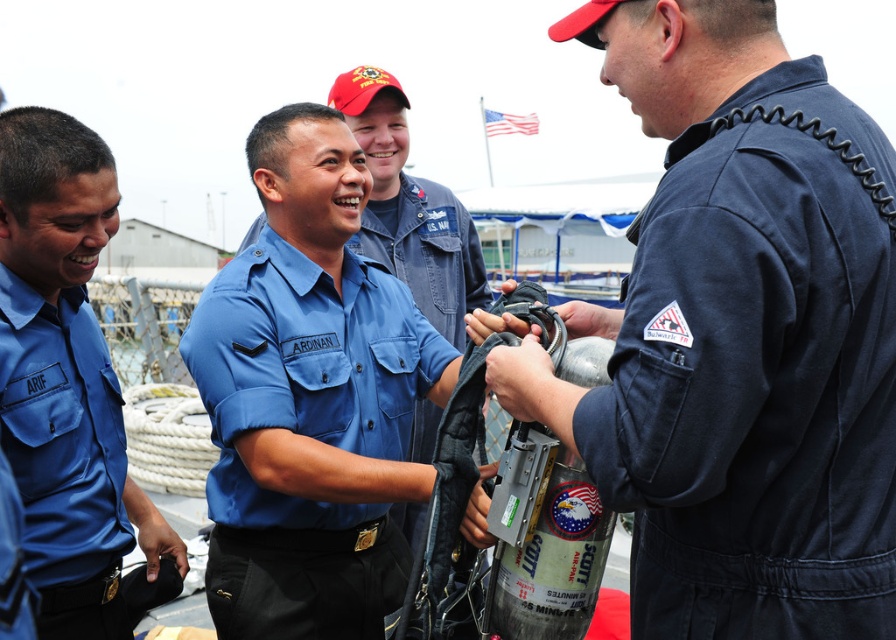
Who is more distant from viewer, (x=811, y=589) or (x=65, y=595)?

The point (x=65, y=595) is more distant.

Image resolution: width=896 pixels, height=640 pixels. In order to click on navy blue fabric jumpsuit at right in this screenshot , I will do `click(757, 374)`.

Image resolution: width=896 pixels, height=640 pixels. Identify the location of navy blue fabric jumpsuit at right. (757, 374).

Does navy blue fabric jumpsuit at right appear on the left side of matte blue shirt at center?

In fact, navy blue fabric jumpsuit at right is to the right of matte blue shirt at center.

Based on the photo, which is more to the right, navy blue fabric jumpsuit at right or matte blue shirt at center?

From the viewer's perspective, navy blue fabric jumpsuit at right appears more on the right side.

The height and width of the screenshot is (640, 896). I want to click on navy blue fabric jumpsuit at right, so click(x=757, y=374).

Between matte blue shirt at center and blue uniform shirt at center, which one appears on the left side from the viewer's perspective?

blue uniform shirt at center

Based on the photo, is matte blue shirt at center further to the viewer compared to blue uniform shirt at center?

Yes, it is behind blue uniform shirt at center.

Is point (225, 336) closer to viewer compared to point (30, 449)?

No, it is behind (30, 449).

Where is `matte blue shirt at center`? matte blue shirt at center is located at coordinates (306, 436).